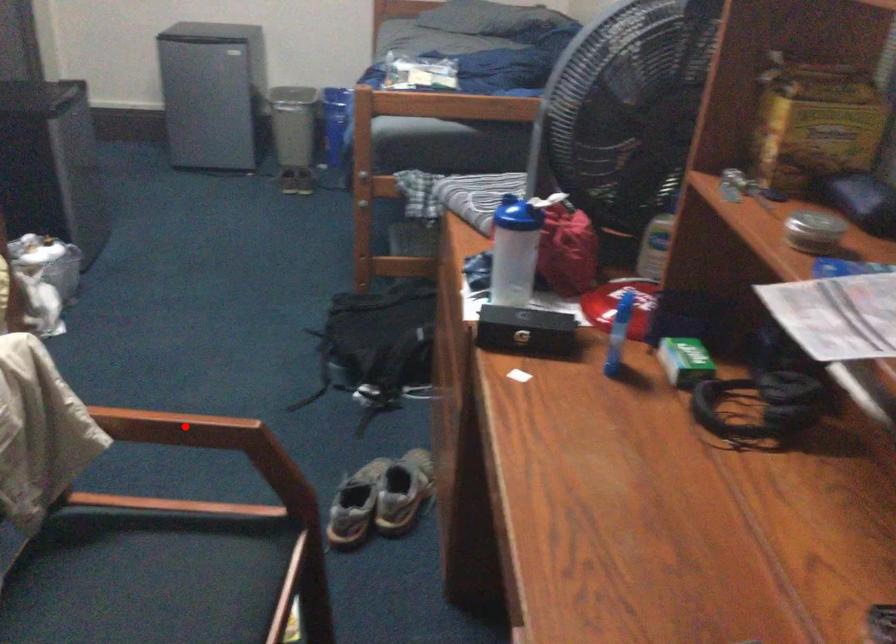
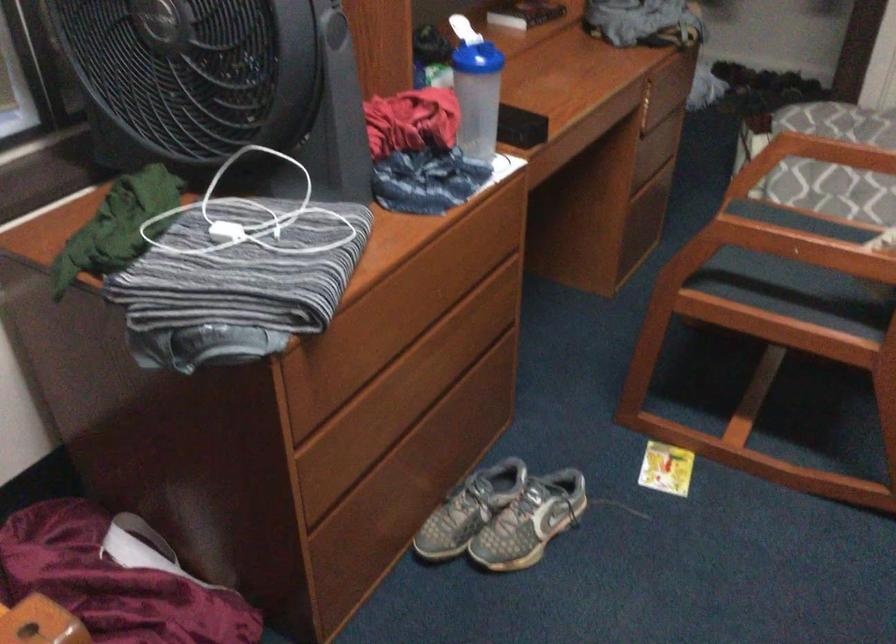
Locate, in the second image, the point that corresponds to the highlighted location in the first image.

(790, 245)